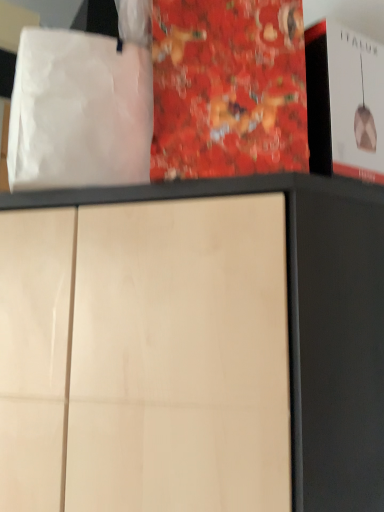
Question: Does red glossy book at center have a larger size compared to white paper bag at upper left?

Choices:
 (A) yes
 (B) no

Answer: (A)

Question: Considering the relative sizes of red glossy book at center and white paper bag at upper left in the image provided, is red glossy book at center shorter than white paper bag at upper left?

Choices:
 (A) no
 (B) yes

Answer: (A)

Question: Does red glossy book at center touch white paper bag at upper left?

Choices:
 (A) no
 (B) yes

Answer: (A)

Question: Is red glossy book at center in front of white paper bag at upper left?

Choices:
 (A) yes
 (B) no

Answer: (B)

Question: Does red glossy book at center appear on the left side of white paper bag at upper left?

Choices:
 (A) yes
 (B) no

Answer: (B)

Question: From the image's perspective, is red glossy book at center above white paper bag at upper left?

Choices:
 (A) no
 (B) yes

Answer: (B)

Question: Are white paper bag at upper left and red glossy book at center making contact?

Choices:
 (A) no
 (B) yes

Answer: (A)

Question: Can you confirm if white paper bag at upper left is taller than red glossy book at center?

Choices:
 (A) yes
 (B) no

Answer: (B)

Question: Is red glossy book at center located within white paper bag at upper left?

Choices:
 (A) yes
 (B) no

Answer: (B)

Question: Is white paper bag at upper left oriented towards red glossy book at center?

Choices:
 (A) yes
 (B) no

Answer: (B)

Question: Is white paper bag at upper left smaller than red glossy book at center?

Choices:
 (A) no
 (B) yes

Answer: (B)

Question: Would you say white paper bag at upper left is a long distance from red glossy book at center?

Choices:
 (A) no
 (B) yes

Answer: (A)

Question: Considering the positions of white paper bag at upper left and red glossy book at center in the image, is white paper bag at upper left bigger or smaller than red glossy book at center?

Choices:
 (A) big
 (B) small

Answer: (B)